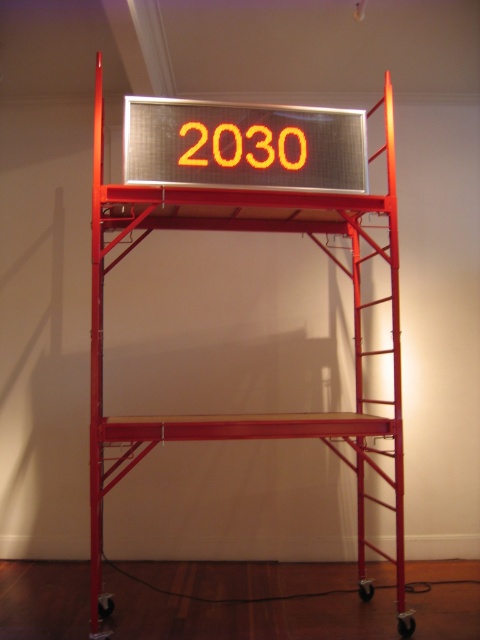
Is metallic red ladder at center taller than orange led sign at center?

Indeed, metallic red ladder at center has a greater height compared to orange led sign at center.

From the picture: Is metallic red ladder at center positioned behind orange led sign at center?

No, metallic red ladder at center is closer to the viewer.

Measure the distance between metallic red ladder at center and camera.

metallic red ladder at center is 2.46 meters away from camera.

The width and height of the screenshot is (480, 640). Identify the location of metallic red ladder at center. (247, 416).

Does metallic red ladder at center come behind orange led digits at center?

No, it is in front of orange led digits at center.

Is metallic red ladder at center to the left of orange led digits at center from the viewer's perspective?

No, metallic red ladder at center is not to the left of orange led digits at center.

Does point (396, 236) come closer to viewer compared to point (218, 157)?

No.

This screenshot has width=480, height=640. I want to click on metallic red ladder at center, so click(x=247, y=416).

Find the location of `orange led sign at center`. orange led sign at center is located at coordinates (243, 145).

Is orange led sign at center closer to the viewer compared to orange led digits at center?

Yes, orange led sign at center is in front of orange led digits at center.

Who is more distant from viewer, (277,106) or (187,122)?

Point (277,106)

Find the location of a particular element. The width and height of the screenshot is (480, 640). orange led sign at center is located at coordinates (243, 145).